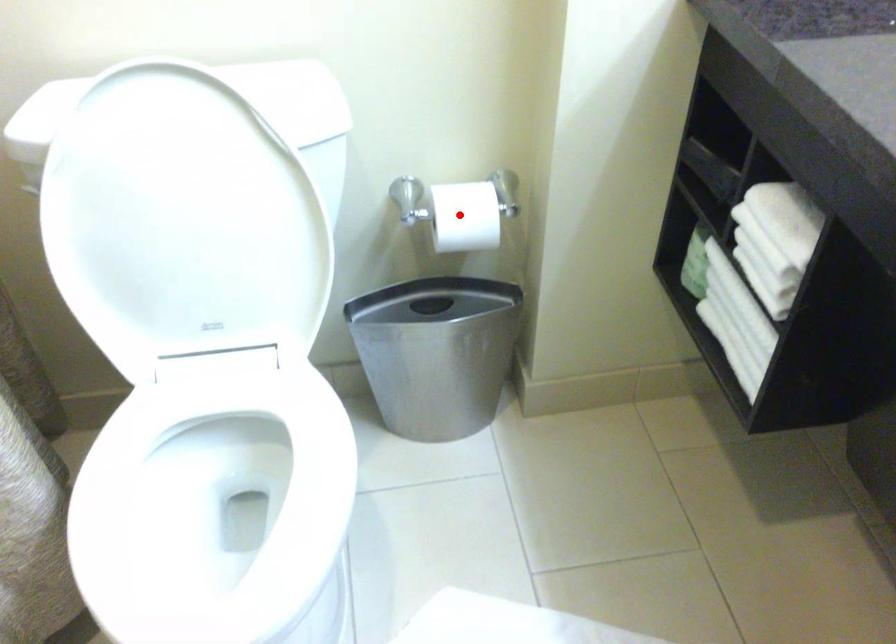
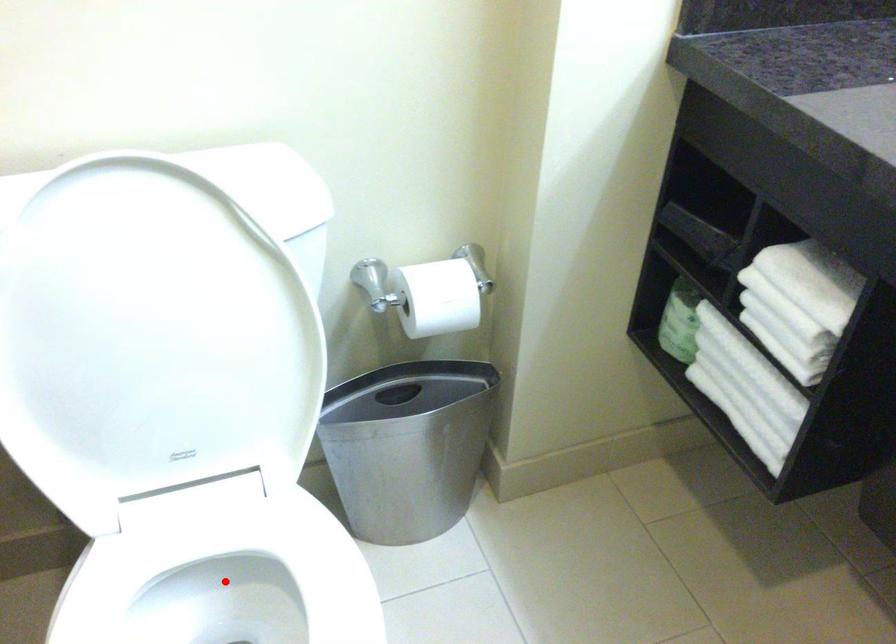
I am providing you with two images of the same scene from different viewpoints. A red point is marked on the first image and another point is marked on the second image. Is the red point in image1 aligned with the point shown in image2?

No